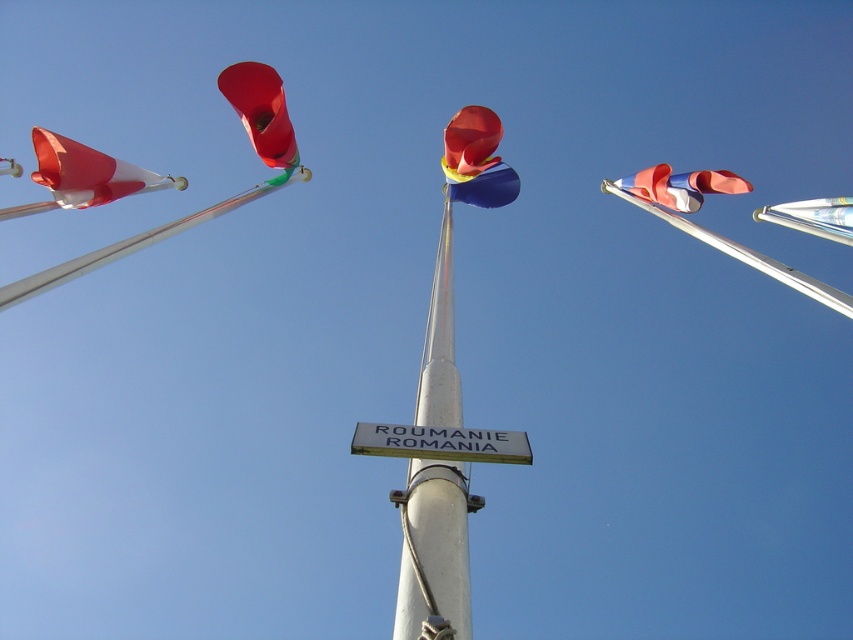
Question: Does silver metallic pole at center appear on the left side of metallic silver flag pole at right?

Choices:
 (A) no
 (B) yes

Answer: (B)

Question: Which point is farther to the camera?

Choices:
 (A) (151, 188)
 (B) (743, 252)

Answer: (A)

Question: Is the position of silver metallic pole at center more distant than that of white/red striped cone at left?

Choices:
 (A) yes
 (B) no

Answer: (B)

Question: Is shiny metallic flag at center wider than matte white flag at right?

Choices:
 (A) yes
 (B) no

Answer: (B)

Question: Which of the following is the farthest from the observer?

Choices:
 (A) (524, 438)
 (B) (73, 196)

Answer: (B)

Question: Which point is closer to the camera?

Choices:
 (A) matte white flag at right
 (B) silver metallic pole at center
 (C) metallic silver flag pole at right
 (D) shiny metallic flag at center

Answer: (B)